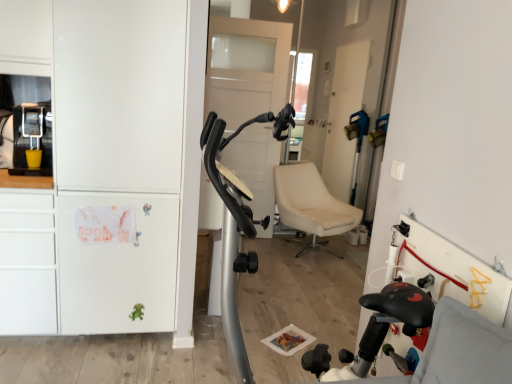
Question: Is matte black coffee machine at left not inside white matte cabinet at left?

Choices:
 (A) yes
 (B) no

Answer: (A)

Question: From a real-world perspective, is matte black coffee machine at left positioned under white matte cabinet at left based on gravity?

Choices:
 (A) no
 (B) yes

Answer: (A)

Question: Considering the relative sizes of matte black coffee machine at left and white matte cabinet at left in the image provided, is matte black coffee machine at left shorter than white matte cabinet at left?

Choices:
 (A) no
 (B) yes

Answer: (B)

Question: Does matte black coffee machine at left have a lesser width compared to white matte cabinet at left?

Choices:
 (A) no
 (B) yes

Answer: (B)

Question: Is matte black coffee machine at left at the right side of white matte cabinet at left?

Choices:
 (A) yes
 (B) no

Answer: (B)

Question: Considering the relative positions of matte black coffee machine at left and white matte cabinet at left in the image provided, is matte black coffee machine at left to the left of white matte cabinet at left from the viewer's perspective?

Choices:
 (A) yes
 (B) no

Answer: (A)

Question: From the image's perspective, is white matte cabinet at left over matte black coffee machine at left?

Choices:
 (A) no
 (B) yes

Answer: (A)

Question: Is white matte cabinet at left to the left of matte black coffee machine at left from the viewer's perspective?

Choices:
 (A) no
 (B) yes

Answer: (A)

Question: Considering the relative sizes of white matte cabinet at left and matte black coffee machine at left in the image provided, is white matte cabinet at left wider than matte black coffee machine at left?

Choices:
 (A) no
 (B) yes

Answer: (B)

Question: Is white matte cabinet at left oriented towards matte black coffee machine at left?

Choices:
 (A) no
 (B) yes

Answer: (A)

Question: Considering the relative sizes of white matte cabinet at left and matte black coffee machine at left in the image provided, is white matte cabinet at left bigger than matte black coffee machine at left?

Choices:
 (A) yes
 (B) no

Answer: (A)

Question: Is the depth of white matte cabinet at left greater than that of matte black coffee machine at left?

Choices:
 (A) yes
 (B) no

Answer: (B)

Question: In terms of size, does white matte cabinet at left appear bigger or smaller than matte black coffee machine at left?

Choices:
 (A) small
 (B) big

Answer: (B)